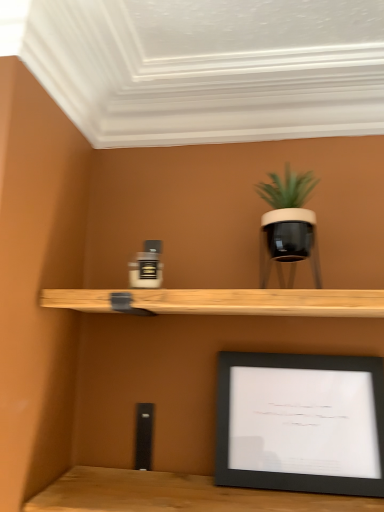
Where is `matte black pot at upper right`? This screenshot has width=384, height=512. matte black pot at upper right is located at coordinates (x=288, y=215).

What do you see at coordinates (288, 215) in the screenshot?
I see `matte black pot at upper right` at bounding box center [288, 215].

Locate an element on the screen. black matte picture frame at lower right is located at coordinates (300, 423).

The height and width of the screenshot is (512, 384). What do you see at coordinates (300, 423) in the screenshot?
I see `black matte picture frame at lower right` at bounding box center [300, 423].

You are a GUI agent. You are given a task and a screenshot of the screen. Output one action in this format:
    pyautogui.click(x=<x>, y=<y>)
    Task: Click on the matte black pot at upper right
    Image resolution: width=384 pixels, height=512 pixels.
    Given the screenshot: What is the action you would take?
    pyautogui.click(x=288, y=215)

Considering the positions of objects black matte picture frame at lower right and matte black pot at upper right in the image provided, who is more to the right, black matte picture frame at lower right or matte black pot at upper right?

black matte picture frame at lower right is more to the right.

Which object is further away from the camera, black matte picture frame at lower right or matte black pot at upper right?

black matte picture frame at lower right is further from the camera.

Considering the points (289, 441) and (278, 217), which point is in front, point (289, 441) or point (278, 217)?

The point (278, 217) is closer to the camera.

From the image's perspective, which one is positioned higher, black matte picture frame at lower right or matte black pot at upper right?

matte black pot at upper right appears higher in the image.

From a real-world perspective, which is physically above, black matte picture frame at lower right or matte black pot at upper right?

matte black pot at upper right.

Looking at this image, can you confirm if black matte picture frame at lower right is thinner than matte black pot at upper right?

Yes, black matte picture frame at lower right is thinner than matte black pot at upper right.

Can you confirm if black matte picture frame at lower right is taller than matte black pot at upper right?

Correct, black matte picture frame at lower right is much taller as matte black pot at upper right.

Which of these two, black matte picture frame at lower right or matte black pot at upper right, is bigger?

black matte picture frame at lower right is bigger.

Is matte black pot at upper right inside black matte picture frame at lower right?

No, matte black pot at upper right is not surrounded by black matte picture frame at lower right.

Is black matte picture frame at lower right next to matte black pot at upper right and touching it?

black matte picture frame at lower right and matte black pot at upper right are clearly separated.

Is black matte picture frame at lower right looking in the opposite direction of matte black pot at upper right?

No, black matte picture frame at lower right is not facing the opposite direction of matte black pot at upper right.

Can you tell me how much black matte picture frame at lower right and matte black pot at upper right differ in facing direction?

The angular difference between black matte picture frame at lower right and matte black pot at upper right is 0.863 degrees.

Where is `picture frame beneath the matte black pot at upper right (from a real-world perspective)`? The height and width of the screenshot is (512, 384). picture frame beneath the matte black pot at upper right (from a real-world perspective) is located at coordinates tap(300, 423).

Visually, is matte black pot at upper right positioned to the left or to the right of black matte picture frame at lower right?

matte black pot at upper right is positioned on black matte picture frame at lower right's left side.

In the image, is matte black pot at upper right positioned in front of or behind black matte picture frame at lower right?

matte black pot at upper right is in front of black matte picture frame at lower right.

Which is in front, point (296, 204) or point (313, 397)?

Point (296, 204)

From the image's perspective, which one is positioned higher, matte black pot at upper right or black matte picture frame at lower right?

matte black pot at upper right.

From a real-world perspective, is matte black pot at upper right physically located above or below black matte picture frame at lower right?

A: In terms of real-world spatial position, matte black pot at upper right is above black matte picture frame at lower right.

Is matte black pot at upper right wider or thinner than black matte picture frame at lower right?

In the image, matte black pot at upper right appears to be wider than black matte picture frame at lower right.

Is matte black pot at upper right shorter than black matte picture frame at lower right?

Yes, matte black pot at upper right is shorter than black matte picture frame at lower right.

Based on their sizes in the image, would you say matte black pot at upper right is bigger or smaller than black matte picture frame at lower right?

Considering their sizes, matte black pot at upper right takes up less space than black matte picture frame at lower right.

Would you say matte black pot at upper right is inside or outside black matte picture frame at lower right?

matte black pot at upper right is not inside black matte picture frame at lower right, it's outside.

Are matte black pot at upper right and black matte picture frame at lower right located far from each other?

matte black pot at upper right is near black matte picture frame at lower right, not far away.

Is matte black pot at upper right aimed at black matte picture frame at lower right?

No, matte black pot at upper right is not oriented towards black matte picture frame at lower right.

How different are the orientations of matte black pot at upper right and black matte picture frame at lower right in degrees?

There is a 0.863-degree angle between the facing directions of matte black pot at upper right and black matte picture frame at lower right.

Find the location of a particular element. houseplant that appears above the black matte picture frame at lower right (from a real-world perspective) is located at coordinates (288, 215).

I want to click on houseplant that is on the left side of black matte picture frame at lower right, so click(288, 215).

Where is `picture frame that is on the right side of matte black pot at upper right`? picture frame that is on the right side of matte black pot at upper right is located at coordinates (300, 423).